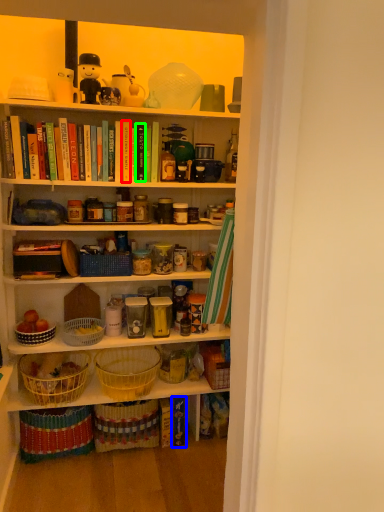
Question: Considering the real-world distances, which object is farthest from book (highlighted by a red box)? book (highlighted by a blue box) or book (highlighted by a green box)?

Choices:
 (A) book
 (B) book

Answer: (A)